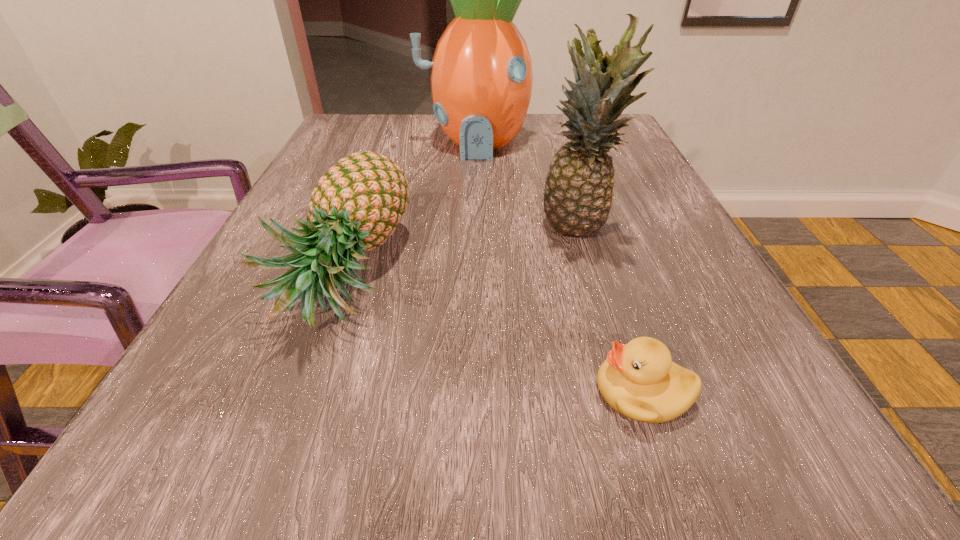
Where is `vacant space located at the face of the duckling`? This screenshot has width=960, height=540. vacant space located at the face of the duckling is located at coordinates (481, 392).

The image size is (960, 540). In order to click on object positioned at the far edge in this screenshot , I will do `click(481, 73)`.

Identify the location of object that is positioned at the near edge. (639, 380).

Identify the location of object located at the left edge. (359, 202).

Where is `pineapple situated at the right edge`? The width and height of the screenshot is (960, 540). pineapple situated at the right edge is located at coordinates (578, 193).

Identify the location of duckling that is at the right edge. The width and height of the screenshot is (960, 540). (639, 380).

Find the location of a particular element. The height and width of the screenshot is (540, 960). object that is at the near right corner is located at coordinates (639, 380).

In the image, there is a desktop. Where is `blank space at the far edge`? The height and width of the screenshot is (540, 960). blank space at the far edge is located at coordinates (412, 121).

This screenshot has width=960, height=540. What are the coordinates of `free space at the right edge of the desktop` in the screenshot? It's located at (684, 234).

Locate an element on the screen. vacant region at the far left corner is located at coordinates (350, 129).